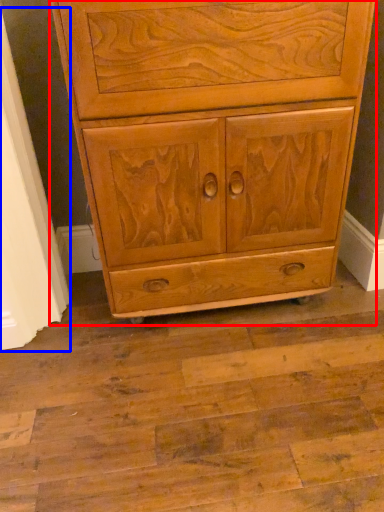
Question: Which of the following is the closest to the observer, chest of drawers (highlighted by a red box) or screen door (highlighted by a blue box)?

Choices:
 (A) chest of drawers
 (B) screen door

Answer: (A)